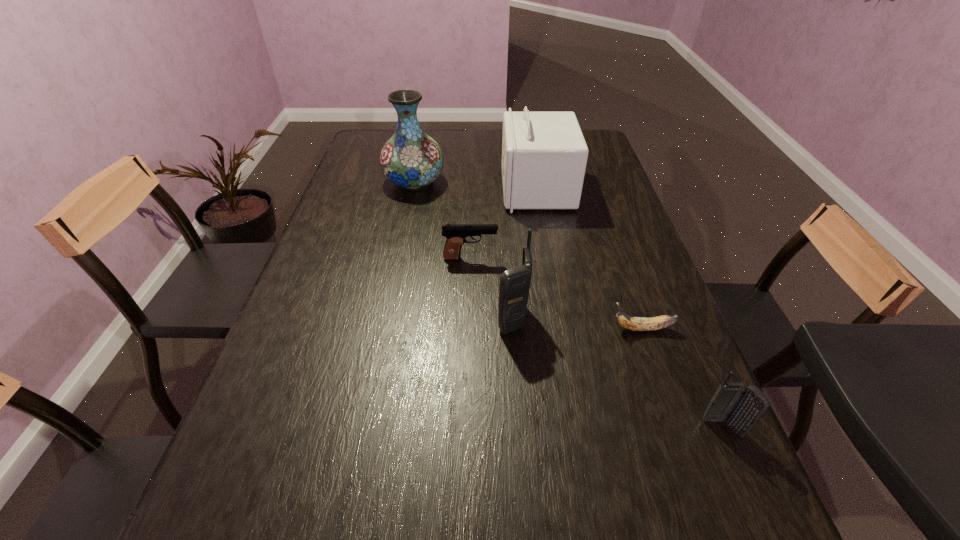
Where is `the taller cellular telephone`? the taller cellular telephone is located at coordinates (514, 288).

Locate an element on the screen. The width and height of the screenshot is (960, 540). the farther cellular telephone is located at coordinates (514, 288).

At what (x,y) coordinates should I click in order to perform the action: click on the nearer cellular telephone. Please return your answer as a coordinate pair (x, y). This screenshot has height=540, width=960. Looking at the image, I should click on (741, 407).

Where is `the right cellular telephone`? This screenshot has height=540, width=960. the right cellular telephone is located at coordinates (741, 407).

Image resolution: width=960 pixels, height=540 pixels. Identify the location of the first-aid kit. (544, 154).

What are the coordinates of `the leftmost object` in the screenshot? It's located at (411, 159).

At what (x,y) coordinates should I click in order to perform the action: click on the fourth nearest object. Please return your answer as a coordinate pair (x, y). This screenshot has width=960, height=540. Looking at the image, I should click on (455, 234).

Where is `the second shortest object`? the second shortest object is located at coordinates (455, 234).

You are a GUI agent. You are given a task and a screenshot of the screen. Output one action in this format:
    pyautogui.click(x=<x>, y=<y>)
    Task: Click on the shortest object
    Image resolution: width=960 pixels, height=540 pixels.
    Given the screenshot: What is the action you would take?
    pyautogui.click(x=632, y=323)

Where is `vacant area located on the keyboard of the farther cellular telephone`? The image size is (960, 540). vacant area located on the keyboard of the farther cellular telephone is located at coordinates (445, 319).